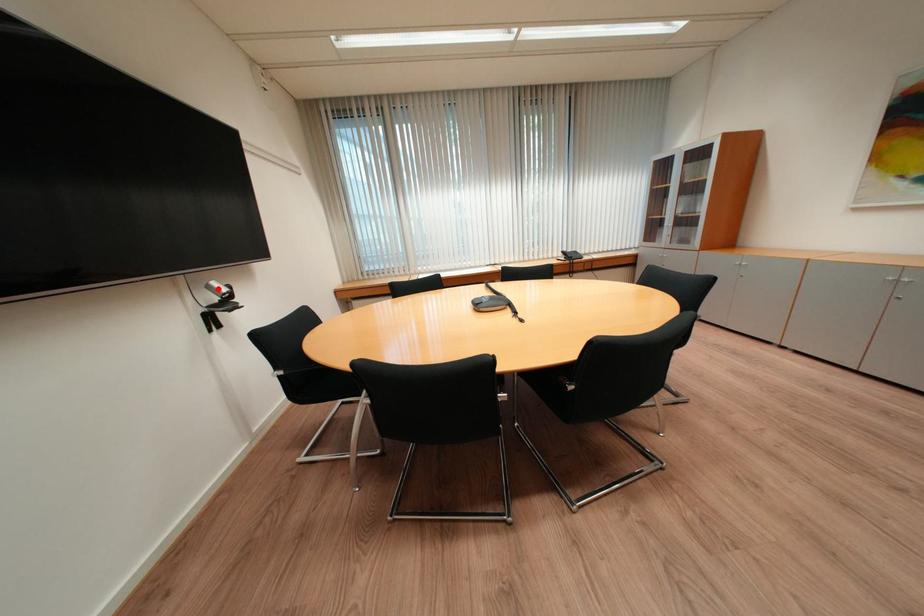
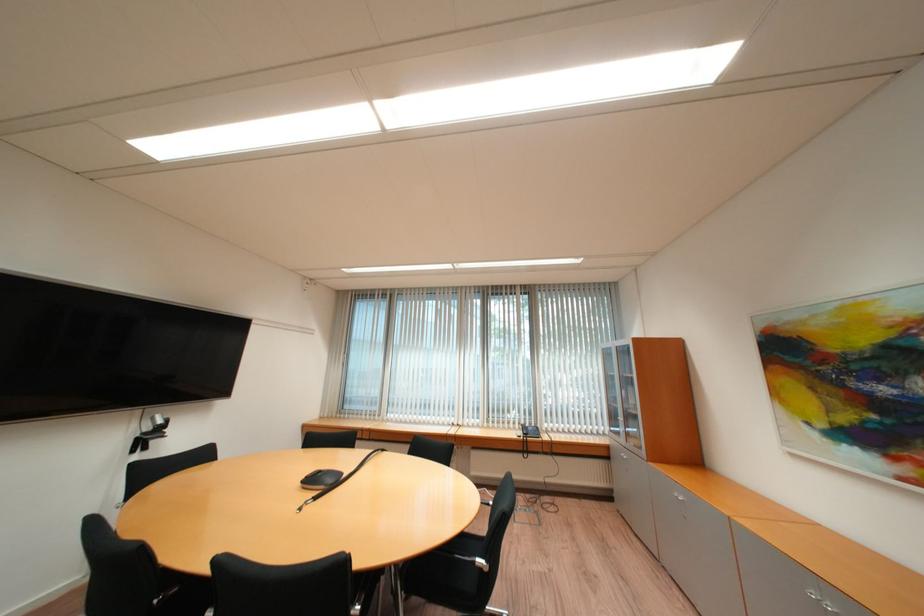
Question: I am providing you with two images of the same scene from different viewpoints. A red point is marked on the first image. Can you still see the location of the red point in image 2?

Choices:
 (A) Yes
 (B) No

Answer: (A)